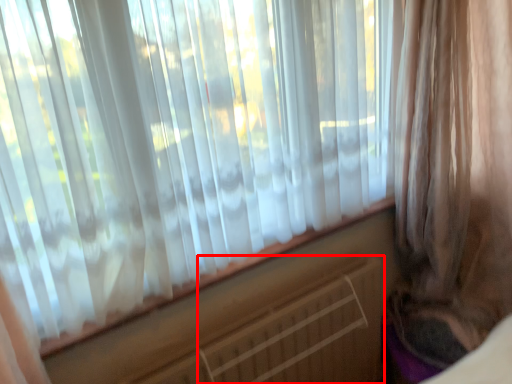
Question: Observing the image, what is the correct spatial positioning of radiator (annotated by the red box) in reference to curtain?

Choices:
 (A) right
 (B) left

Answer: (B)